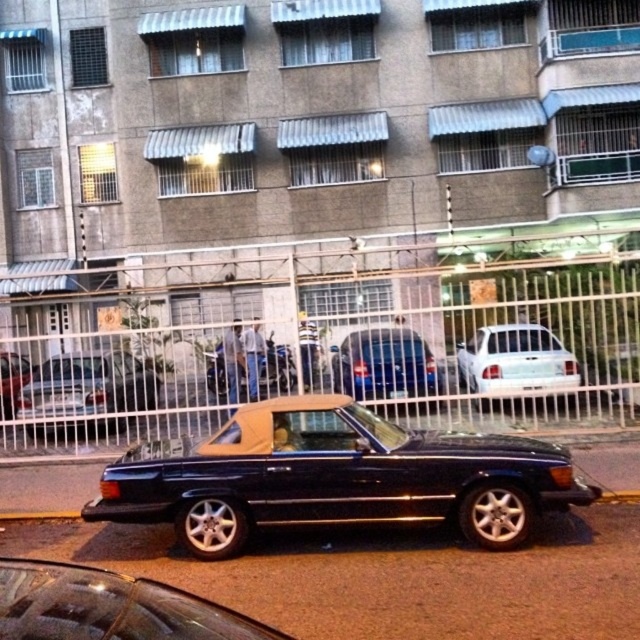
Between white matte sedan at center and black plastic license plate at center, which one has more height?

white matte sedan at center

Can you confirm if white matte sedan at center is wider than black plastic license plate at center?

Indeed, white matte sedan at center has a greater width compared to black plastic license plate at center.

The image size is (640, 640). I want to click on white matte sedan at center, so click(x=515, y=364).

Between point (400, 353) and point (285, 355), which one is positioned in front?

Positioned in front is point (400, 353).

Locate an element on the screen. Image resolution: width=640 pixels, height=640 pixels. metallic silver fence at center is located at coordinates (346, 356).

Who is more distant from viewer, [416,371] or [292,365]?

Positioned behind is point [292,365].

The image size is (640, 640). I want to click on metallic silver fence at center, so click(x=346, y=356).

Is shiny black convertible at center below shiny silver convertible at center?

Yes, shiny black convertible at center is below shiny silver convertible at center.

Is shiny black convertible at center to the left of shiny silver convertible at center from the viewer's perspective?

In fact, shiny black convertible at center is to the right of shiny silver convertible at center.

At what (x,y) coordinates should I click in order to perform the action: click on shiny black convertible at center. Please return your answer as a coordinate pair (x, y). Looking at the image, I should click on (336, 477).

Identify the location of shiny black convertible at center. (336, 477).